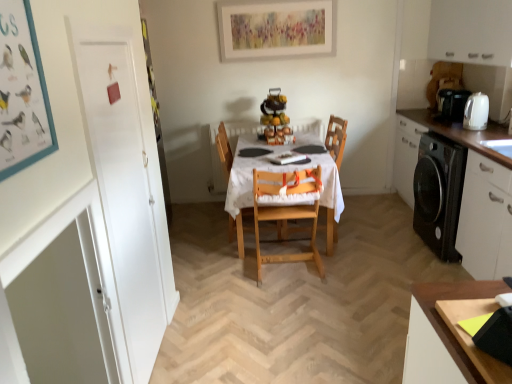
Question: Considering their positions, is wooden table at center located in front of or behind natural wood highchair at center, the 2th chair positioned from the back?

Choices:
 (A) front
 (B) behind

Answer: (B)

Question: From their relative heights in the image, would you say wooden table at center is taller or shorter than natural wood highchair at center, the 1th chair when ordered from front to back?

Choices:
 (A) short
 (B) tall

Answer: (A)

Question: Considering the real-world distances, which object is farthest from the natural wood highchair at center, the 1th chair when ordered from front to back?

Choices:
 (A) wooden chair at center, the first chair positioned from the back
 (B) white matte cabinet at upper right, positioned as the second cabinetry in bottom-to-top order
 (C) white matte cabinet at right, which appears as the 1th cabinetry when ordered from the bottom
 (D) wooden table at center
 (E) black plastic coffee machine at right

Answer: (B)

Question: Estimate the real-world distances between objects in this image. Which object is closer to the wooden chair at center, the first chair positioned from the back?

Choices:
 (A) black plastic coffee machine at right
 (B) white matte cabinet at upper right, positioned as the second cabinetry in bottom-to-top order
 (C) white glossy kettle at right
 (D) white matte cabinet at right, the 2th cabinetry in the top-to-bottom sequence
 (E) wooden table at center

Answer: (E)